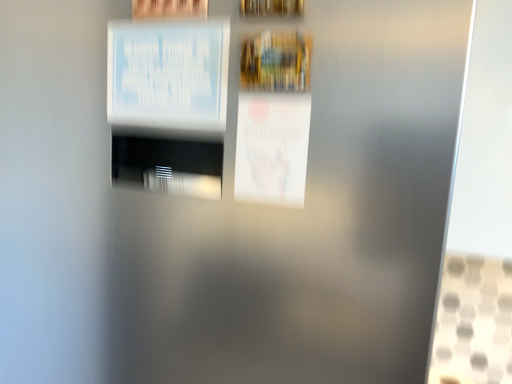
The image size is (512, 384). What do you see at coordinates (272, 8) in the screenshot? I see `wooden picture frame at upper center` at bounding box center [272, 8].

What is the approximate height of white paper at upper left, which is the second poster from right to left?

It is 4.14 inches.

This screenshot has width=512, height=384. In order to click on wooden picture frame at upper center in this screenshot , I will do `click(272, 8)`.

Is wooden picture frame at upper center spatially inside white paper poster at center, which appears as the 2th poster when viewed from the top, or outside of it?

wooden picture frame at upper center cannot be found inside white paper poster at center, which appears as the 2th poster when viewed from the top.

Which of these two, wooden picture frame at upper center or white paper poster at center, which appears as the second poster when viewed from the left, is bigger?

white paper poster at center, which appears as the second poster when viewed from the left.

Who is taller, wooden picture frame at upper center or white paper poster at center, which is counted as the first poster, starting from the right?

Standing taller between the two is white paper poster at center, which is counted as the first poster, starting from the right.

Is wooden picture frame at upper center oriented away from white paper poster at center, which appears as the 2th poster when viewed from the top?

No.

Is the position of wooden picture frame at upper center more distant than that of white paper at upper left, which is the second poster from right to left?

That is False.

From a real-world perspective, which is physically below, wooden picture frame at upper center or white paper at upper left, the 1th poster positioned from the left?

white paper at upper left, the 1th poster positioned from the left, is physically lower.

Consider the image. Is wooden picture frame at upper center spatially inside white paper at upper left, arranged as the second poster when ordered from the bottom, or outside of it?

wooden picture frame at upper center is not enclosed by white paper at upper left, arranged as the second poster when ordered from the bottom.

Can you confirm if wooden picture frame at upper center is smaller than white paper at upper left, which is the second poster from right to left?

Yes, wooden picture frame at upper center is smaller than white paper at upper left, which is the second poster from right to left.

Could you measure the distance between white paper poster at center, marked as the 1th poster in a bottom-to-top arrangement, and white paper at upper left, the first poster from the top?

white paper poster at center, marked as the 1th poster in a bottom-to-top arrangement, is 3.31 inches from white paper at upper left, the first poster from the top.

Can we say white paper poster at center, which appears as the 2th poster when viewed from the top, lies outside white paper at upper left, the first poster from the top?

white paper poster at center, which appears as the 2th poster when viewed from the top, lies outside white paper at upper left, the first poster from the top,'s area.

Based on the photo, is white paper poster at center, which appears as the second poster when viewed from the left, to the left or to the right of white paper at upper left, the first poster from the top, in the image?

From the image, it's evident that white paper poster at center, which appears as the second poster when viewed from the left, is to the right of white paper at upper left, the first poster from the top.

Is white paper poster at center, which appears as the 2th poster when viewed from the top, turned away from white paper at upper left, arranged as the second poster when ordered from the bottom?

That's not correct — white paper poster at center, which appears as the 2th poster when viewed from the top, is not looking away from white paper at upper left, arranged as the second poster when ordered from the bottom.

From the picture: Is white paper poster at center, which appears as the 2th poster when viewed from the top, next to wooden picture frame at upper center?

They are not placed beside each other.

Between white paper poster at center, which is counted as the first poster, starting from the right, and wooden picture frame at upper center, which one is positioned in front?

wooden picture frame at upper center is in front.

From the image's perspective, does white paper poster at center, which appears as the second poster when viewed from the left, appear lower than wooden picture frame at upper center?

Correct, white paper poster at center, which appears as the second poster when viewed from the left, appears lower than wooden picture frame at upper center in the image.

Which is more to the left, white paper poster at center, marked as the 1th poster in a bottom-to-top arrangement, or wooden picture frame at upper center?

Positioned to the left is white paper poster at center, marked as the 1th poster in a bottom-to-top arrangement.

Can you confirm if white paper at upper left, which is the second poster from right to left, is bigger than white paper poster at center, marked as the 1th poster in a bottom-to-top arrangement?

Yes, white paper at upper left, which is the second poster from right to left, is bigger than white paper poster at center, marked as the 1th poster in a bottom-to-top arrangement.

Is white paper at upper left, which is the second poster from right to left, facing towards white paper poster at center, which appears as the 2th poster when viewed from the top?

No, white paper at upper left, which is the second poster from right to left, does not turn towards white paper poster at center, which appears as the 2th poster when viewed from the top.

Consider the image. Measure the distance between white paper at upper left, which is the second poster from right to left, and white paper poster at center, marked as the 1th poster in a bottom-to-top arrangement.

white paper at upper left, which is the second poster from right to left, is 3.31 inches away from white paper poster at center, marked as the 1th poster in a bottom-to-top arrangement.

From a real-world perspective, is white paper at upper left, which is the second poster from right to left, physically located above or below white paper poster at center, which appears as the 2th poster when viewed from the top?

white paper at upper left, which is the second poster from right to left, is situated higher than white paper poster at center, which appears as the 2th poster when viewed from the top, in the real world.

Considering the sizes of objects white paper at upper left, which is the second poster from right to left, and wooden picture frame at upper center in the image provided, who is smaller, white paper at upper left, which is the second poster from right to left, or wooden picture frame at upper center?

Smaller between the two is wooden picture frame at upper center.

From a real-world perspective, is white paper at upper left, arranged as the second poster when ordered from the bottom, on wooden picture frame at upper center?

Incorrect, from a real-world perspective, white paper at upper left, arranged as the second poster when ordered from the bottom, is lower than wooden picture frame at upper center.

Is white paper at upper left, the first poster from the top, turned away from wooden picture frame at upper center?

No.

Identify the location of the 2nd poster directly beneath the wooden picture frame at upper center (from a real-world perspective). The height and width of the screenshot is (384, 512). (272, 148).

Where is `picture frame lying in front of the white paper at upper left, which is the second poster from right to left`? picture frame lying in front of the white paper at upper left, which is the second poster from right to left is located at coordinates (272, 8).

When comparing their distances from white paper at upper left, the first poster from the top, does white paper poster at center, which appears as the second poster when viewed from the left, or wooden picture frame at upper center seem further?

Based on the image, wooden picture frame at upper center appears to be further to white paper at upper left, the first poster from the top.

Looking at the image, which one is located closer to white paper poster at center, which is counted as the first poster, starting from the right, white paper at upper left, which is the second poster from right to left, or wooden picture frame at upper center?

The object closer to white paper poster at center, which is counted as the first poster, starting from the right, is white paper at upper left, which is the second poster from right to left.

From the image, which object appears to be nearer to white paper at upper left, the first poster from the top, wooden picture frame at upper center or white paper poster at center, which appears as the second poster when viewed from the left?

white paper poster at center, which appears as the second poster when viewed from the left, lies closer to white paper at upper left, the first poster from the top, than the other object.

Based on their spatial positions, is wooden picture frame at upper center or white paper at upper left, which is the second poster from right to left, closer to white paper poster at center, which appears as the 2th poster when viewed from the top?

white paper at upper left, which is the second poster from right to left, lies closer to white paper poster at center, which appears as the 2th poster when viewed from the top, than the other object.

Estimate the real-world distances between objects in this image. Which object is further from wooden picture frame at upper center, white paper poster at center, which appears as the 2th poster when viewed from the top, or white paper at upper left, which is the second poster from right to left?

The object further to wooden picture frame at upper center is white paper poster at center, which appears as the 2th poster when viewed from the top.

Considering their positions, is white paper at upper left, arranged as the second poster when ordered from the bottom, positioned closer to wooden picture frame at upper center than white paper poster at center, which is counted as the first poster, starting from the right?

white paper at upper left, arranged as the second poster when ordered from the bottom, is closer to wooden picture frame at upper center.

What are the coordinates of `poster between wooden picture frame at upper center and white paper poster at center, which appears as the 2th poster when viewed from the top, from top to bottom` in the screenshot? It's located at (168, 74).